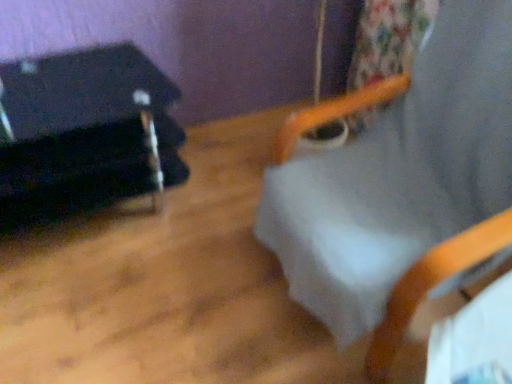
Question: Is black fabric at left looking in the opposite direction of white fabric beach chair at upper center?

Choices:
 (A) yes
 (B) no

Answer: (B)

Question: Is black fabric at left far away from white fabric beach chair at upper center?

Choices:
 (A) no
 (B) yes

Answer: (A)

Question: Considering the relative sizes of black fabric at left and white fabric beach chair at upper center in the image provided, is black fabric at left shorter than white fabric beach chair at upper center?

Choices:
 (A) no
 (B) yes

Answer: (B)

Question: Is white fabric beach chair at upper center inside black fabric at left?

Choices:
 (A) yes
 (B) no

Answer: (B)

Question: Is black fabric at left outside white fabric beach chair at upper center?

Choices:
 (A) no
 (B) yes

Answer: (B)

Question: Considering the relative positions of black fabric at left and white fabric beach chair at upper center in the image provided, is black fabric at left in front of white fabric beach chair at upper center?

Choices:
 (A) no
 (B) yes

Answer: (A)

Question: From a real-world perspective, does white fabric beach chair at upper center sit lower than black fabric at left?

Choices:
 (A) no
 (B) yes

Answer: (A)

Question: Is black fabric at left located within white fabric beach chair at upper center?

Choices:
 (A) yes
 (B) no

Answer: (B)

Question: Can you confirm if white fabric beach chair at upper center is smaller than black fabric at left?

Choices:
 (A) yes
 (B) no

Answer: (B)

Question: Is white fabric beach chair at upper center positioned with its back to black fabric at left?

Choices:
 (A) yes
 (B) no

Answer: (B)

Question: Considering the relative positions of white fabric beach chair at upper center and black fabric at left in the image provided, is white fabric beach chair at upper center in front of black fabric at left?

Choices:
 (A) yes
 (B) no

Answer: (A)

Question: From a real-world perspective, is white fabric beach chair at upper center positioned over black fabric at left based on gravity?

Choices:
 (A) yes
 (B) no

Answer: (A)

Question: In the image, is white fabric beach chair at upper center positioned in front of or behind black fabric at left?

Choices:
 (A) front
 (B) behind

Answer: (A)